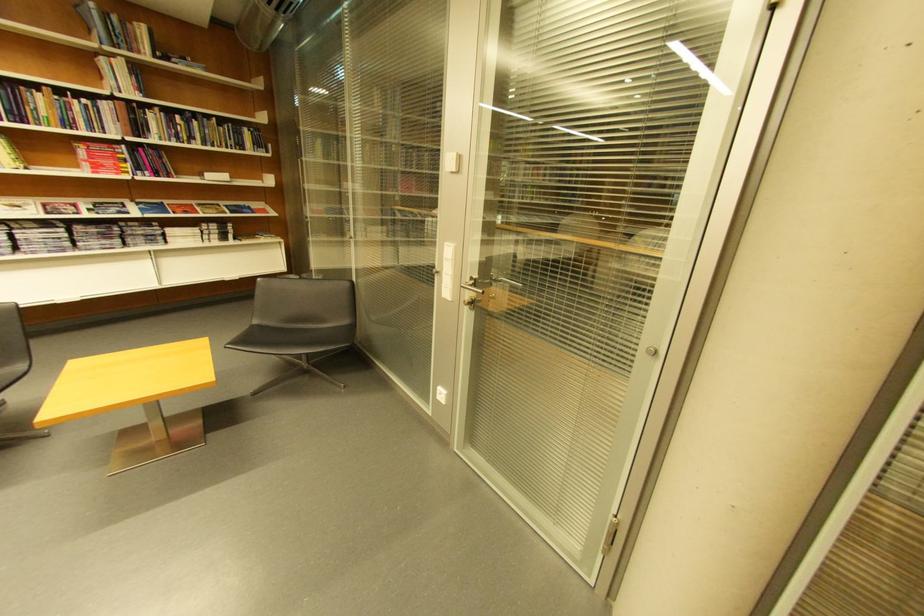
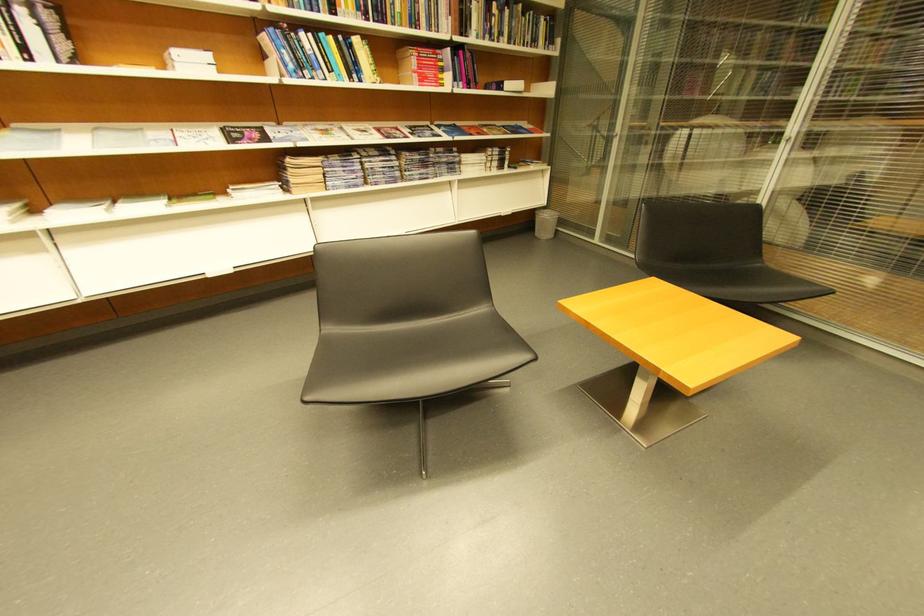
Question: Which direction would the cameraman need to move to produce the second image? Reply with the corresponding letter.

Choices:
 (A) Left
 (B) Right
 (C) Forward
 (D) Backward

Answer: (A)